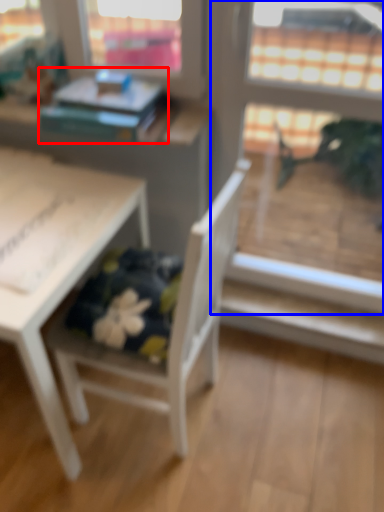
Question: Which object is further to the camera taking this photo, book (highlighted by a red box) or screen door (highlighted by a blue box)?

Choices:
 (A) book
 (B) screen door

Answer: (A)